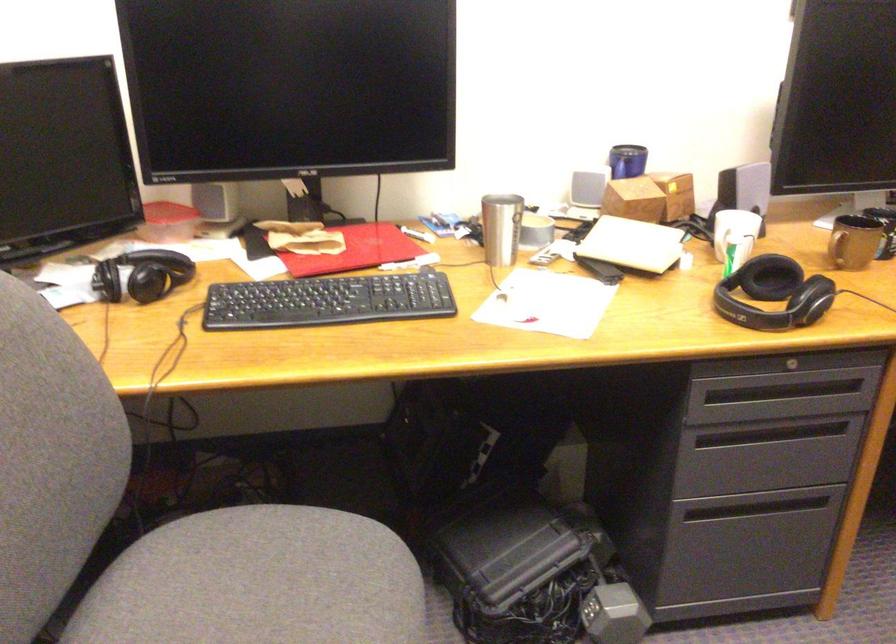
Identify the location of brown mug handle. This screenshot has width=896, height=644. (854, 242).